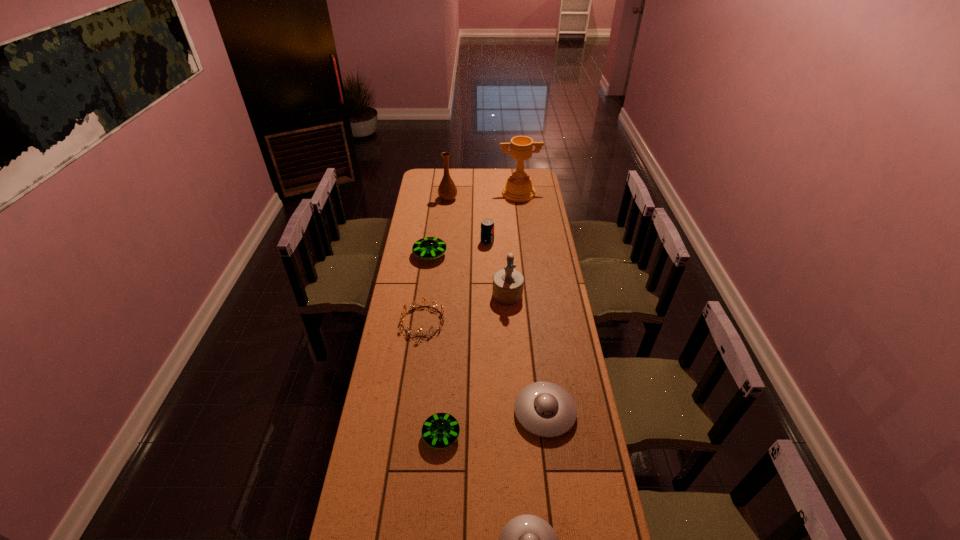
What are the coordinates of `free space between the tiara and the farthest saucer` in the screenshot? It's located at (426, 288).

Where is `free space between the pop and the bigger green saucer`? This screenshot has width=960, height=540. free space between the pop and the bigger green saucer is located at coordinates (459, 248).

Find the location of a particular element. This screenshot has height=540, width=960. free space that is in between the sixth shortest object and the award is located at coordinates (503, 218).

This screenshot has height=540, width=960. I want to click on vacant region between the farther gray saucer and the white figurine, so click(526, 353).

At what (x,y) coordinates should I click in order to perform the action: click on vacant area that lies between the pop and the white figurine. Please return your answer as a coordinate pair (x, y). The image size is (960, 540). Looking at the image, I should click on (497, 268).

Identify the location of free spot between the award and the vase. (483, 197).

I want to click on the seventh closest object to the tiara, so click(x=447, y=191).

I want to click on the seventh closest object relative to the white figurine, so click(447, 191).

Find the location of a particular element. This screenshot has height=540, width=960. saucer that is the third closest to the farthest saucer is located at coordinates (527, 539).

Locate an element on the screen. saucer that is the closest to the figurine is located at coordinates (427, 248).